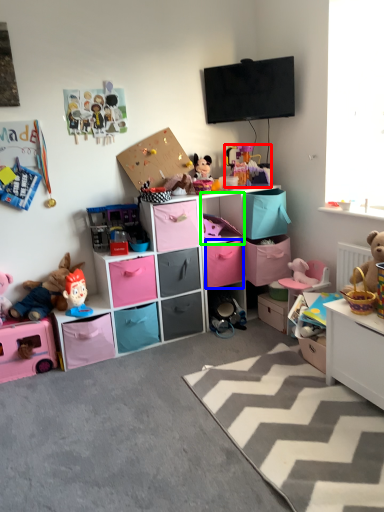
Question: Which object is the farthest from toy (highlighted by a red box)? Choose among these: drawer (highlighted by a blue box) or cabinet (highlighted by a green box).

Choices:
 (A) drawer
 (B) cabinet

Answer: (A)